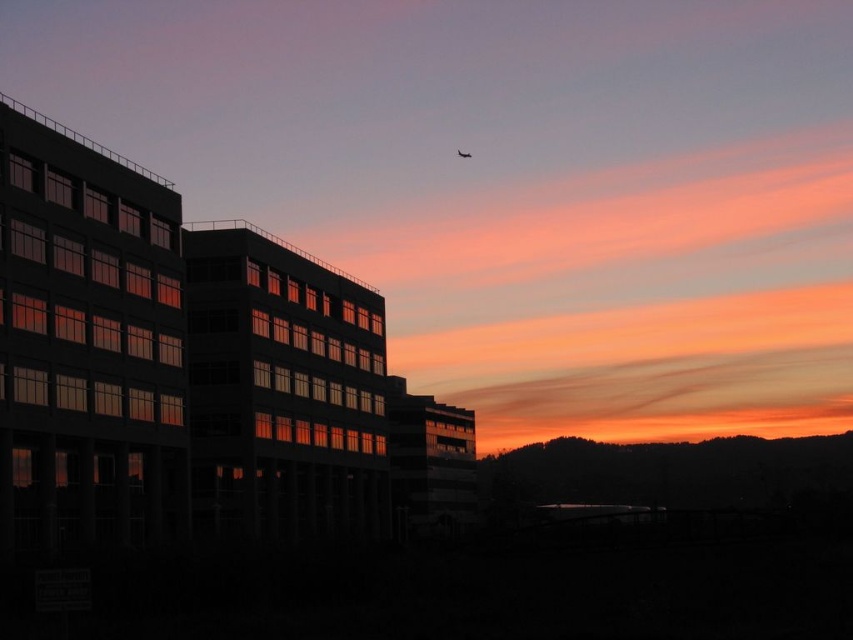
Question: Which point is farther to the camera?

Choices:
 (A) (457, 156)
 (B) (421, 120)

Answer: (A)

Question: Can you confirm if matte glass building at left is wider than translucent glass airplane at upper center?

Choices:
 (A) no
 (B) yes

Answer: (B)

Question: Does matte glass building at left lie behind translucent glass airplane at upper center?

Choices:
 (A) yes
 (B) no

Answer: (B)

Question: Is matte glass building at left further to camera compared to translucent glass airplane at upper center?

Choices:
 (A) yes
 (B) no

Answer: (B)

Question: Among these objects, which one is nearest to the camera?

Choices:
 (A) matte glass building at left
 (B) translucent glass airplane at upper center

Answer: (A)

Question: Among these points, which one is farthest from the camera?

Choices:
 (A) (457, 154)
 (B) (409, 52)

Answer: (B)